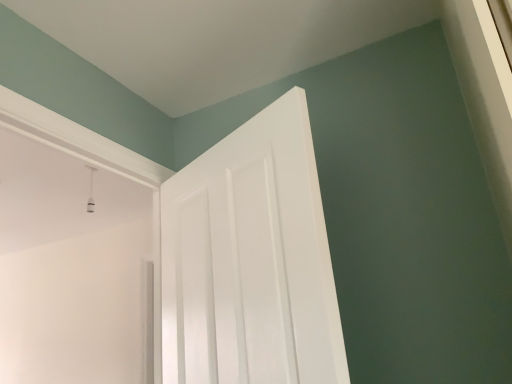
What do you see at coordinates (250, 260) in the screenshot? I see `white glossy door at center` at bounding box center [250, 260].

Where is `white glossy door at center`? The image size is (512, 384). white glossy door at center is located at coordinates (250, 260).

At what (x,y) coordinates should I click in order to perform the action: click on white glossy door at center. Please return your answer as a coordinate pair (x, y). The width and height of the screenshot is (512, 384). Looking at the image, I should click on (250, 260).